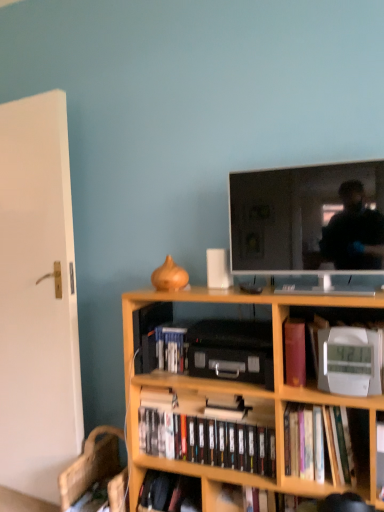
I want to click on vacant area on top of hardcover book at lower center, arranged as the first book when ordered from the bottom (from a real-world perspective), so click(185, 496).